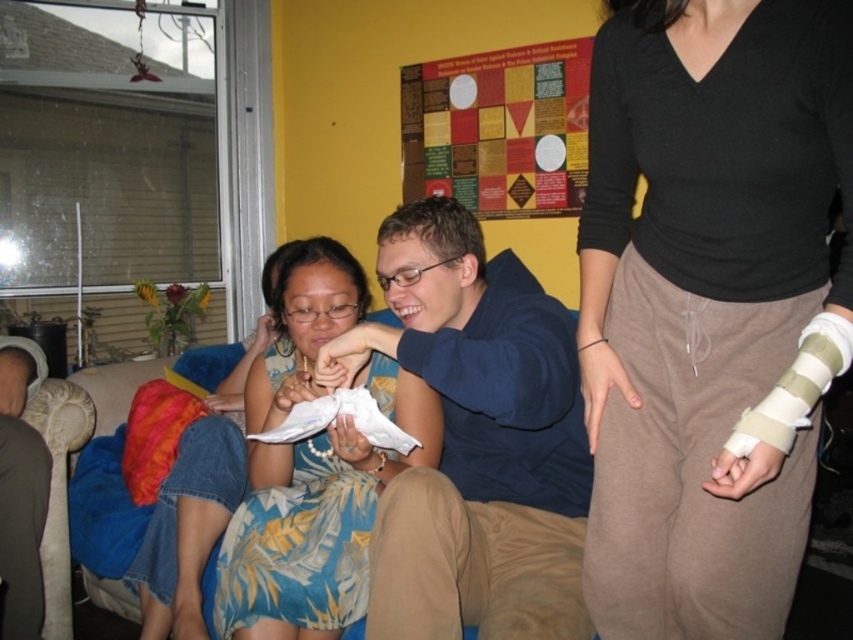
Question: Where is black matte arm cast at center located in relation to blue matte shirt at center in the image?

Choices:
 (A) above
 (B) below

Answer: (A)

Question: Which point is farther from the camera taking this photo?

Choices:
 (A) (625, 12)
 (B) (260, 371)

Answer: (B)

Question: Which of the following is the closest to the observer?

Choices:
 (A) floral print dress at center
 (B) blue matte shirt at center
 (C) black matte arm cast at center

Answer: (C)

Question: Can you confirm if blue matte shirt at center is positioned above floral print dress at center?

Choices:
 (A) yes
 (B) no

Answer: (A)

Question: Which of the following is the closest to the observer?

Choices:
 (A) blue matte shirt at center
 (B) floral print dress at center

Answer: (A)

Question: Can you confirm if black matte arm cast at center is positioned to the right of floral print dress at center?

Choices:
 (A) yes
 (B) no

Answer: (A)